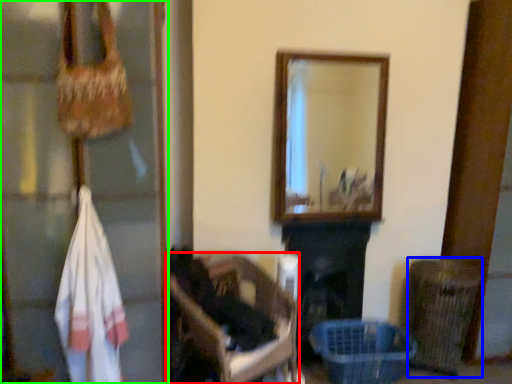
Question: Based on their relative distances, which object is farther from furniture (highlighted by a red box)? Choose from shopping basket (highlighted by a blue box) and glass door (highlighted by a green box).

Choices:
 (A) shopping basket
 (B) glass door

Answer: (A)